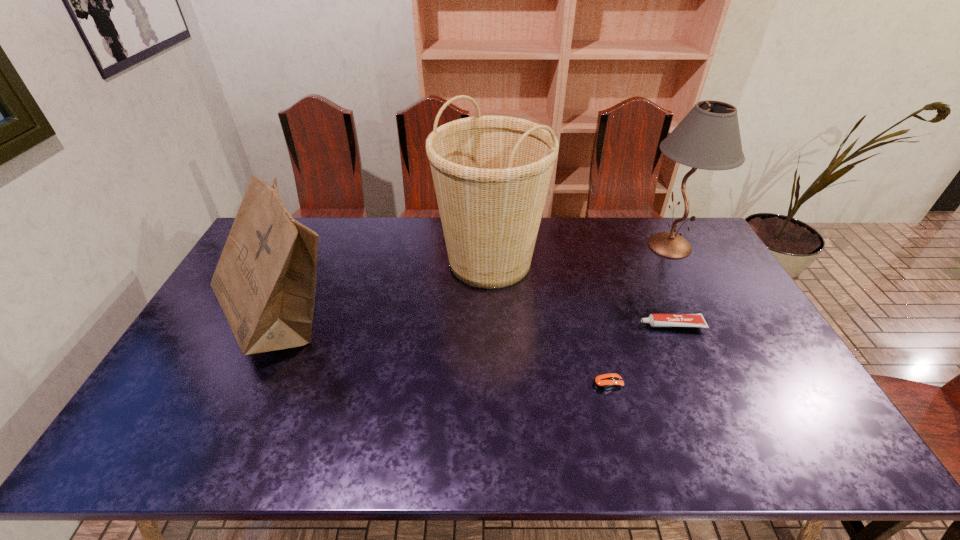
This screenshot has height=540, width=960. I want to click on empty space that is in between the table lamp and the shortest object, so click(638, 314).

I want to click on free spot between the table lamp and the basket, so click(580, 253).

Locate an element on the screen. The image size is (960, 540). blank region between the second object from left to right and the toothpaste is located at coordinates (581, 293).

What are the coordinates of `empty space between the fourth object from right to left and the grocery bag` in the screenshot? It's located at (386, 291).

In order to click on free space between the third tallest object and the second shortest object in this screenshot , I will do `click(477, 323)`.

Find the location of a particular element. This screenshot has height=540, width=960. free space between the shortest object and the fourth tallest object is located at coordinates (639, 354).

Where is `the fourth closest object to the table lamp`? This screenshot has height=540, width=960. the fourth closest object to the table lamp is located at coordinates (265, 281).

Find the location of `object that is the closest to the leftmost object`. object that is the closest to the leftmost object is located at coordinates [491, 174].

What are the coordinates of `vacant area that satisfies the following two spatial constraints: 1. on the back side of the basket; 2. on the right side of the third shortest object` in the screenshot? It's located at (310, 261).

This screenshot has width=960, height=540. Find the location of `vacant space that satisfies the following two spatial constraints: 1. on the front-facing side of the table lamp; 2. on the front side of the leftmost object`. vacant space that satisfies the following two spatial constraints: 1. on the front-facing side of the table lamp; 2. on the front side of the leftmost object is located at coordinates (709, 321).